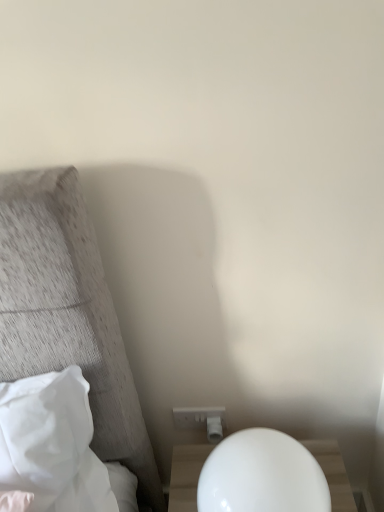
Question: Can you confirm if white soft pillow at left is positioned to the left of white plastic electric outlet at lower center?

Choices:
 (A) no
 (B) yes

Answer: (B)

Question: Is white soft pillow at left looking in the opposite direction of white plastic electric outlet at lower center?

Choices:
 (A) no
 (B) yes

Answer: (A)

Question: Is white soft pillow at left surrounding white plastic electric outlet at lower center?

Choices:
 (A) no
 (B) yes

Answer: (A)

Question: Is white soft pillow at left wider than white plastic electric outlet at lower center?

Choices:
 (A) no
 (B) yes

Answer: (B)

Question: Can you confirm if white soft pillow at left is taller than white plastic electric outlet at lower center?

Choices:
 (A) yes
 (B) no

Answer: (A)

Question: Can you confirm if white soft pillow at left is thinner than white plastic electric outlet at lower center?

Choices:
 (A) yes
 (B) no

Answer: (B)

Question: Is white plastic electric outlet at lower center thinner than white glossy nightstand at lower right?

Choices:
 (A) yes
 (B) no

Answer: (A)

Question: Is white plastic electric outlet at lower center shorter than white glossy nightstand at lower right?

Choices:
 (A) no
 (B) yes

Answer: (B)

Question: Is white plastic electric outlet at lower center far away from white glossy nightstand at lower right?

Choices:
 (A) no
 (B) yes

Answer: (A)

Question: From a real-world perspective, is white plastic electric outlet at lower center beneath white glossy nightstand at lower right?

Choices:
 (A) yes
 (B) no

Answer: (A)

Question: Would you say white plastic electric outlet at lower center is outside white glossy nightstand at lower right?

Choices:
 (A) no
 (B) yes

Answer: (B)

Question: Is white plastic electric outlet at lower center to the left of white glossy nightstand at lower right from the viewer's perspective?

Choices:
 (A) no
 (B) yes

Answer: (B)

Question: Is white plastic electric outlet at lower center not close to white soft pillow at left?

Choices:
 (A) yes
 (B) no

Answer: (B)